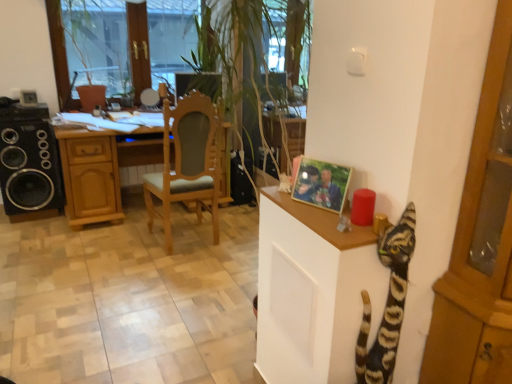
What are the coordinates of `free region on the left part of light brown wood chair at center` in the screenshot? It's located at tap(120, 247).